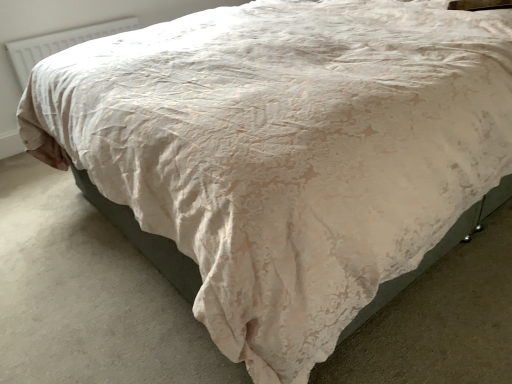
You are a GUI agent. You are given a task and a screenshot of the screen. Output one action in this format:
    pyautogui.click(x=<x>, y=<y>)
    Task: Click on the white plastic radiator at upper left
    
    Given the screenshot: What is the action you would take?
    pyautogui.click(x=60, y=44)

What do you see at coordinates (60, 44) in the screenshot? Image resolution: width=512 pixels, height=384 pixels. I see `white plastic radiator at upper left` at bounding box center [60, 44].

Image resolution: width=512 pixels, height=384 pixels. Identify the location of white plastic radiator at upper left. (60, 44).